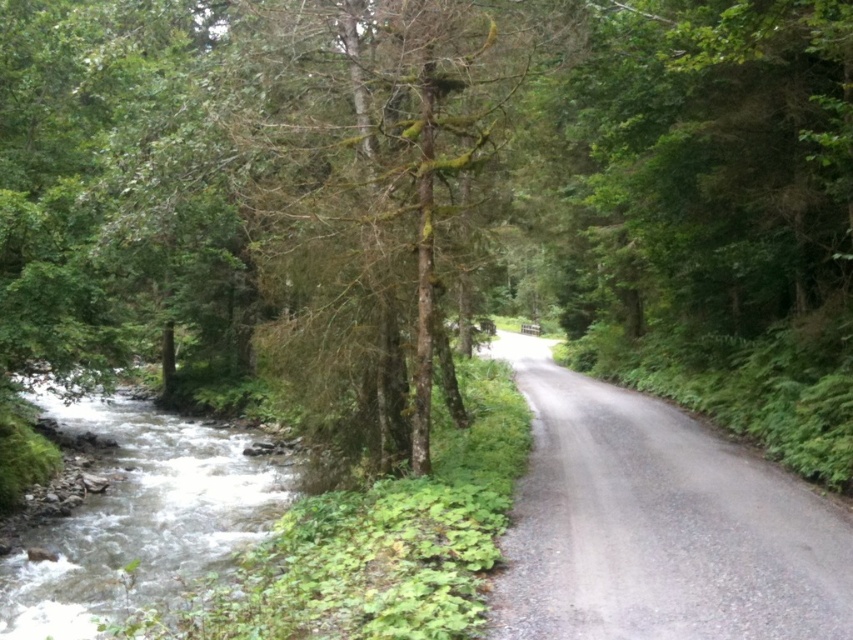
Question: Which point appears closest to the camera in this image?

Choices:
 (A) (581, 390)
 (B) (271, 4)

Answer: (B)

Question: Which point is closer to the camera?

Choices:
 (A) clear water at stream left
 (B) green mossy tree at center
 (C) gray gravel road at center

Answer: (C)

Question: Where is gray gravel road at center located in relation to clear water at stream left in the image?

Choices:
 (A) below
 (B) above

Answer: (B)

Question: Estimate the real-world distances between objects in this image. Which object is farther from the green mossy tree at center?

Choices:
 (A) clear water at stream left
 (B) gray gravel road at center

Answer: (A)

Question: From the image, what is the correct spatial relationship of green mossy tree at center in relation to clear water at stream left?

Choices:
 (A) above
 (B) below

Answer: (A)

Question: Is green mossy tree at center further to the viewer compared to clear water at stream left?

Choices:
 (A) yes
 (B) no

Answer: (A)